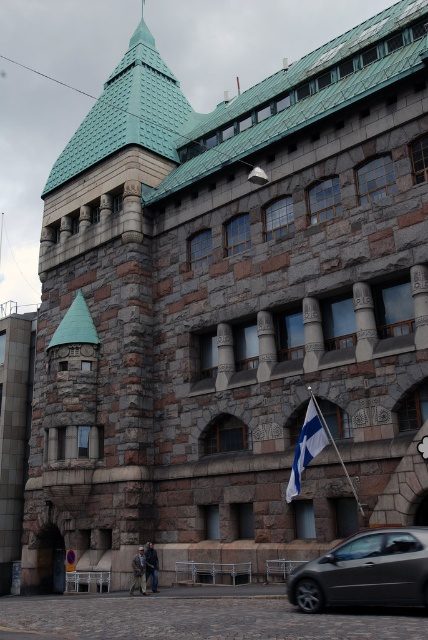
You are standing in front of the historic building and want to take a photo of the white fabric flag at center. However, there is a metallic gray car at lower right blocking your view. Can you move to the left to avoid the car and still see the flag?

The metallic gray car at lower right is closer to the viewer than the white fabric flag at center, so moving to the left might allow you to see around the car and still view the flag.

You are a photographer standing at the front of the historic building. You want to take a picture that includes both the metallic gray car at lower right and the white fabric flag at center. Which object should you adjust your camera angle to include first if you need to ensure both are in the frame?

The metallic gray car at lower right is located below the white fabric flag at center, so you should first adjust your camera angle to include the metallic gray car at lower right since it is lower in the frame.